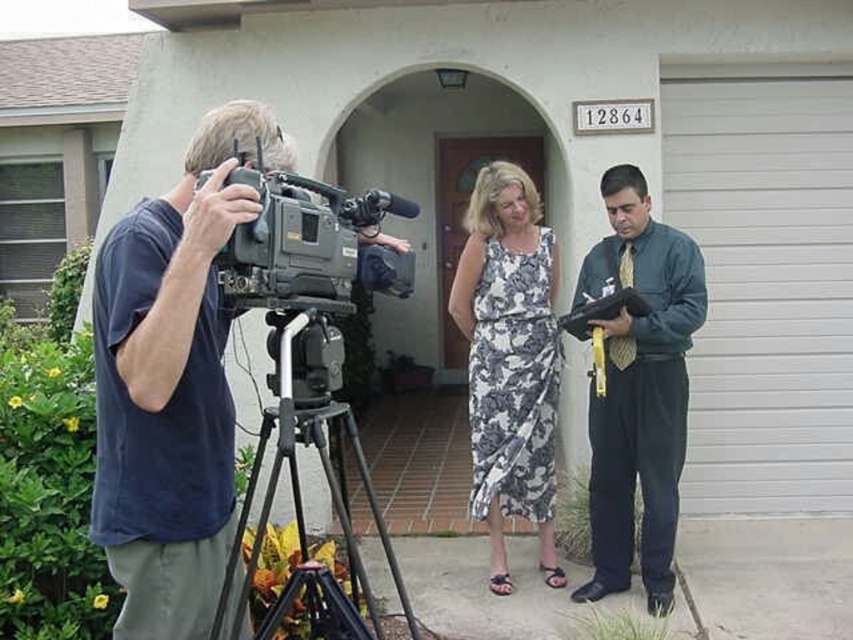
Question: Which is nearer to the black metal tripod at left?

Choices:
 (A) white smooth garage door at center
 (B) black plastic video camera at left

Answer: (B)

Question: Which of the following is the closest to the observer?

Choices:
 (A) (498, 308)
 (B) (469, 163)

Answer: (A)

Question: Does green shirt at right appear under floral-patterned dress at center?

Choices:
 (A) no
 (B) yes

Answer: (B)

Question: Which of these objects is positioned farthest from the green shirt at right?

Choices:
 (A) white smooth garage door at center
 (B) black plastic video camera at left
 (C) black metal tripod at left

Answer: (A)

Question: In this image, where is black plastic video camera at left located relative to white smooth garage door at center?

Choices:
 (A) left
 (B) right

Answer: (A)

Question: Does green shirt at right appear on the right side of floral-patterned dress at center?

Choices:
 (A) yes
 (B) no

Answer: (A)